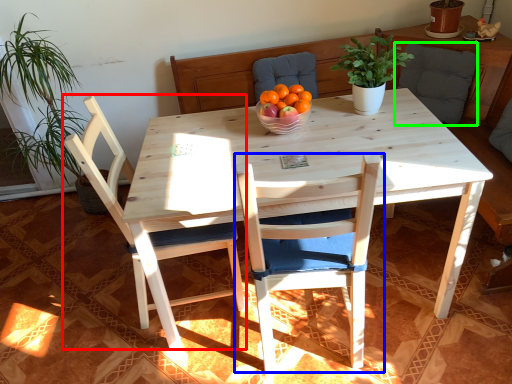
Question: Considering the real-world distances, which object is farthest from chair (highlighted by a red box)? chair (highlighted by a blue box) or armchair (highlighted by a green box)?

Choices:
 (A) chair
 (B) armchair

Answer: (B)